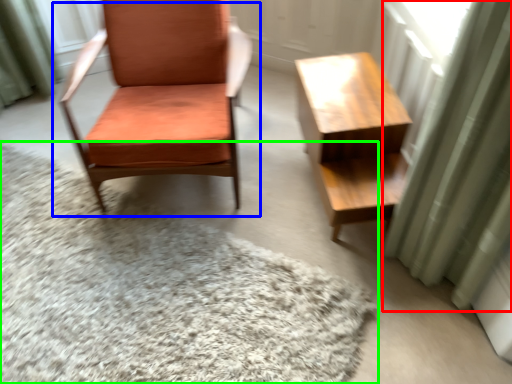
Question: Based on their relative distances, which object is nearer to curtain (highlighted by a red box)? Choose from chair (highlighted by a blue box) and mat (highlighted by a green box).

Choices:
 (A) chair
 (B) mat

Answer: (B)